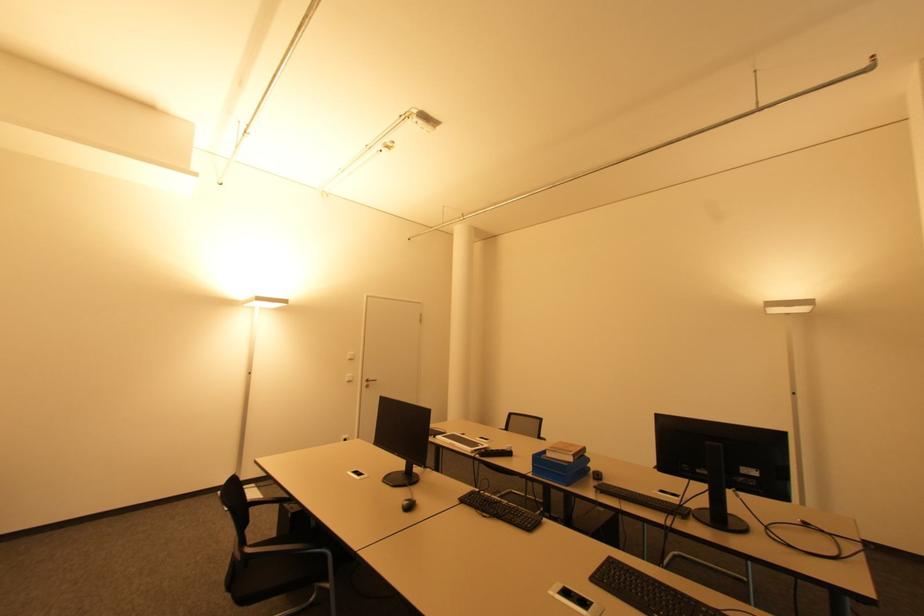
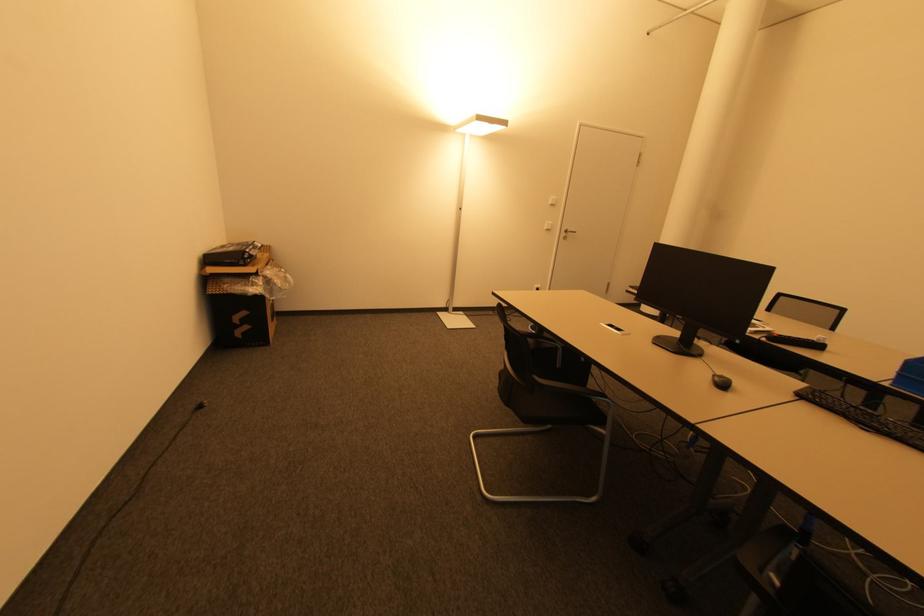
In the second image, find the point that corresponds to (x=511, y=454) in the first image.

(819, 346)